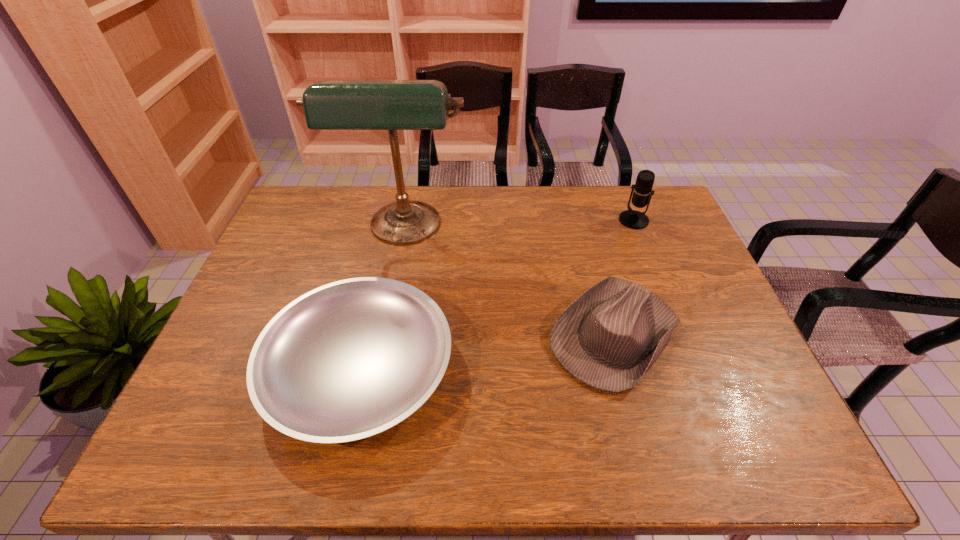
Identify the location of object located at the near edge. [x=351, y=359].

Where is `object at the left edge`? The height and width of the screenshot is (540, 960). object at the left edge is located at coordinates (351, 359).

You are a GUI agent. You are given a task and a screenshot of the screen. Output one action in this format:
    pyautogui.click(x=<x>, y=<y>)
    Task: Click on the microphone present at the right edge
    This screenshot has width=960, height=540.
    Given the screenshot: What is the action you would take?
    point(633,219)

Find the location of a particular element. Image resolution: width=960 pixels, height=540 pixels. fedora present at the right edge is located at coordinates click(x=608, y=338).

Where is `object that is positioned at the near left corner`? The image size is (960, 540). object that is positioned at the near left corner is located at coordinates (351, 359).

Locate an element on the screen. object present at the far right corner is located at coordinates (633, 219).

This screenshot has width=960, height=540. What are the coordinates of `blank space at the far edge of the desktop` in the screenshot? It's located at (383, 196).

At what (x,y) coordinates should I click in order to perform the action: click on vacant space at the near edge of the desktop. Please return your answer as a coordinate pair (x, y). Looking at the image, I should click on (523, 461).

This screenshot has height=540, width=960. What are the coordinates of `vacant space at the left edge` in the screenshot? It's located at (210, 360).

The height and width of the screenshot is (540, 960). Find the location of `vacant space at the right edge of the desktop`. vacant space at the right edge of the desktop is located at coordinates (689, 312).